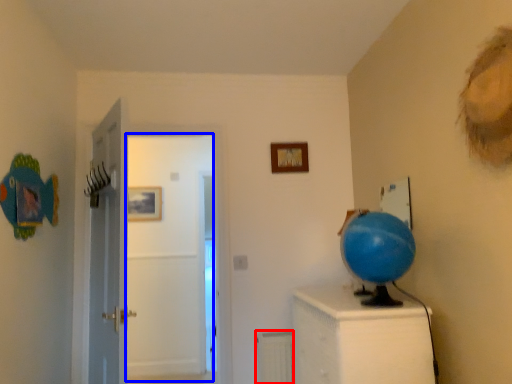
Question: Among these objects, which one is farthest to the camera, radiator (highlighted by a red box) or door (highlighted by a blue box)?

Choices:
 (A) radiator
 (B) door

Answer: (A)